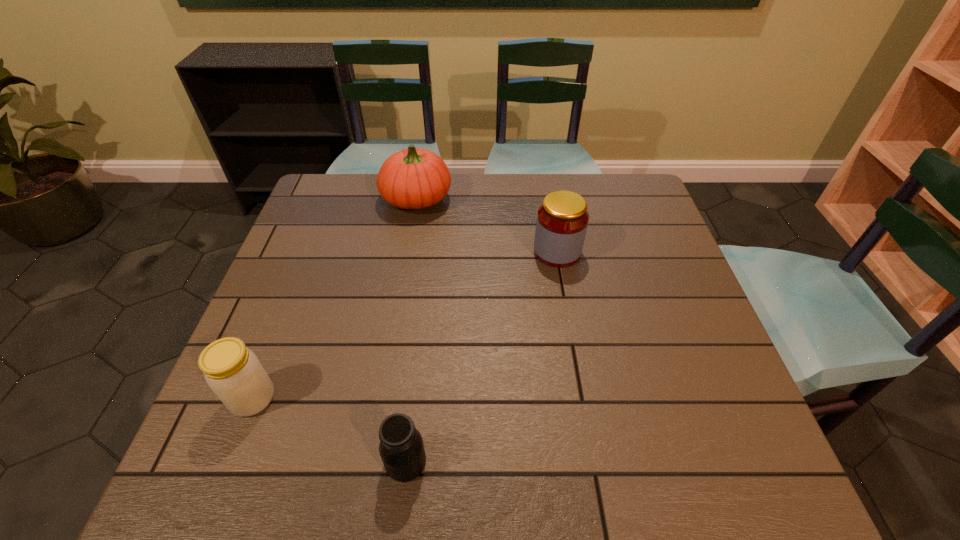
Find the location of `the closest object relative to the shortest object`. the closest object relative to the shortest object is located at coordinates pos(234,373).

Find the location of `jar identified as the second closest to the second jar from left to right`. jar identified as the second closest to the second jar from left to right is located at coordinates (562, 220).

Identify which jar is the nearest to the rightmost jar. Please provide its 2D coordinates. Your answer should be formatted as a tuple, i.e. [(x, y)], where the tuple contains the x and y coordinates of a point satisfying the conditions above.

[(401, 448)]

The height and width of the screenshot is (540, 960). Find the location of `vacant space that satisfies the following two spatial constraints: 1. on the back side of the second nearest object; 2. on the right side of the pumpkin`. vacant space that satisfies the following two spatial constraints: 1. on the back side of the second nearest object; 2. on the right side of the pumpkin is located at coordinates (331, 199).

Locate an element on the screen. The height and width of the screenshot is (540, 960). free spot that satisfies the following two spatial constraints: 1. on the front side of the second farthest object; 2. on the left side of the pumpkin is located at coordinates (407, 252).

This screenshot has height=540, width=960. Identify the location of vacant area in the image that satisfies the following two spatial constraints: 1. on the back side of the leftmost object; 2. on the left side of the farthest jar. (310, 252).